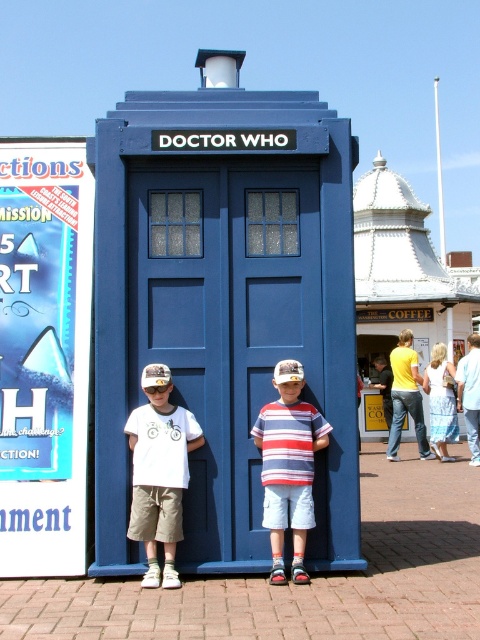
Is white cotton shirt at center below striped cotton shirt at center?

Yes, white cotton shirt at center is below striped cotton shirt at center.

Is point (170, 472) in front of point (298, 404)?

Yes, it is.

The image size is (480, 640). Describe the element at coordinates (159, 472) in the screenshot. I see `white cotton shirt at center` at that location.

Image resolution: width=480 pixels, height=640 pixels. Identify the location of white cotton shirt at center. (159, 472).

Does white cotton shirt at center have a greater width compared to yellow cotton shirt at center?

No, white cotton shirt at center is not wider than yellow cotton shirt at center.

Consider the image. Between white cotton shirt at center and yellow cotton shirt at center, which one has more height?

yellow cotton shirt at center

What do you see at coordinates (159, 472) in the screenshot? I see `white cotton shirt at center` at bounding box center [159, 472].

Where is `white cotton shirt at center`? This screenshot has width=480, height=640. white cotton shirt at center is located at coordinates (159, 472).

Which of these two, striped cotton shirt at center or yellow cotton shirt at center, stands shorter?

striped cotton shirt at center

Image resolution: width=480 pixels, height=640 pixels. I want to click on striped cotton shirt at center, so click(288, 467).